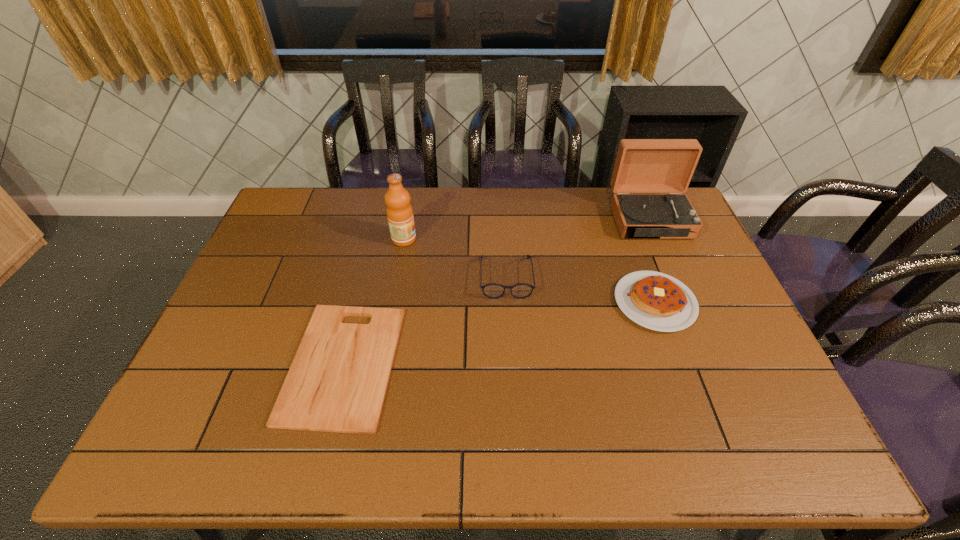
What are the coordinates of `free space that is in between the fourth tallest object and the shortest object` in the screenshot? It's located at (499, 333).

Locate which object is the closest to the fruit juice. Please provide its 2D coordinates. Your answer should be formatted as a tuple, i.e. [(x, y)], where the tuple contains the x and y coordinates of a point satisfying the conditions above.

[(493, 290)]

Select which object appears as the fourth closest to the fruit juice. Please provide its 2D coordinates. Your answer should be formatted as a tuple, i.e. [(x, y)], where the tuple contains the x and y coordinates of a point satisfying the conditions above.

[(642, 165)]

Where is `free region that satisfies the following two spatial constraints: 1. on the back side of the pancake; 2. on the label side of the fruit juice`? free region that satisfies the following two spatial constraints: 1. on the back side of the pancake; 2. on the label side of the fruit juice is located at coordinates (632, 239).

Locate an element on the screen. Image resolution: width=960 pixels, height=540 pixels. vacant region that satisfies the following two spatial constraints: 1. on the face of the phonograph record; 2. on the label side of the fruit juice is located at coordinates (659, 239).

Where is `vacant region that satisfies the following two spatial constraints: 1. on the front-facing side of the second shortest object; 2. on the right side of the third object from left to right`? The width and height of the screenshot is (960, 540). vacant region that satisfies the following two spatial constraints: 1. on the front-facing side of the second shortest object; 2. on the right side of the third object from left to right is located at coordinates (508, 302).

Locate an element on the screen. vacant point that satisfies the following two spatial constraints: 1. on the back side of the shortest object; 2. on the right side of the fourth tallest object is located at coordinates (359, 302).

You are a GUI agent. You are given a task and a screenshot of the screen. Output one action in this format:
    pyautogui.click(x=<x>, y=<y>)
    Task: Click on the free space that satisfies the following two spatial constraints: 1. on the label side of the pancake; 2. on the right side of the fruit juice
    The image size is (960, 540).
    Given the screenshot: What is the action you would take?
    pyautogui.click(x=393, y=302)